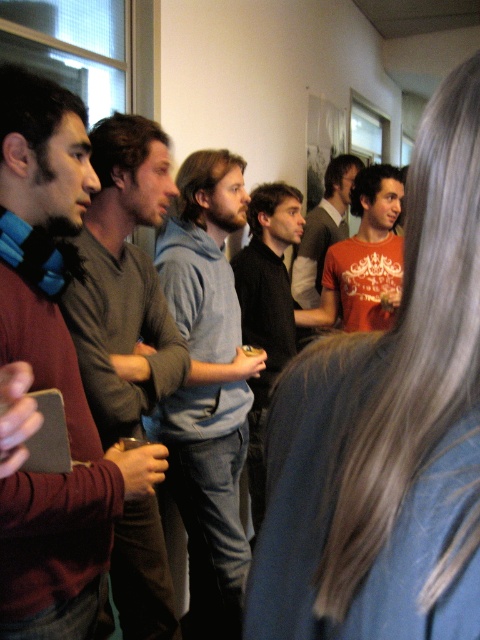
Question: Does light gray hoodie at center appear over gray sweater at center?

Choices:
 (A) yes
 (B) no

Answer: (B)

Question: Estimate the real-world distances between objects in this image. Which object is closer to the light gray hoodie at center?

Choices:
 (A) matte orange t-shirt at center
 (B) black matte shirt at center

Answer: (B)

Question: Among these objects, which one is farthest from the camera?

Choices:
 (A) gray sweater at center
 (B) matte orange t-shirt at center
 (C) black matte shirt at center
 (D) light gray hoodie at center

Answer: (B)

Question: Is light gray hoodie at center in front of matte orange t-shirt at center?

Choices:
 (A) yes
 (B) no

Answer: (A)

Question: Can you confirm if light gray hoodie at center is wider than matte orange t-shirt at center?

Choices:
 (A) yes
 (B) no

Answer: (B)

Question: Based on their relative distances, which object is nearer to the gray sweater at center?

Choices:
 (A) matte orange t-shirt at center
 (B) light gray hoodie at center
 (C) black matte shirt at center

Answer: (B)